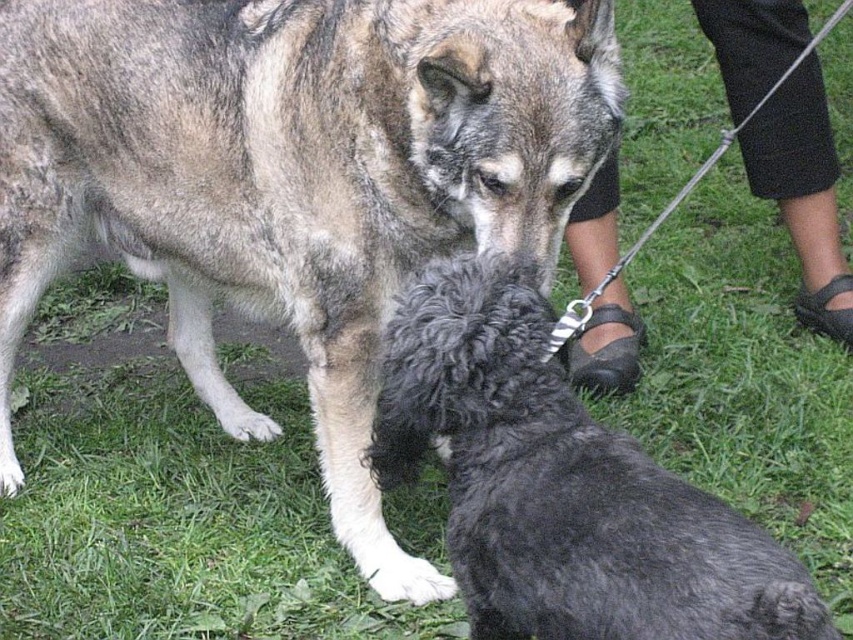
Can you confirm if shiny black fur at center is taller than black leather sandals at lower right?

In fact, shiny black fur at center may be shorter than black leather sandals at lower right.

Is point (447, 525) positioned after point (796, 148)?

That is False.

Is point (602, 588) positioned after point (697, 3)?

No.

Where is `shiny black fur at center`? Image resolution: width=853 pixels, height=640 pixels. shiny black fur at center is located at coordinates (561, 484).

Who is taller, shaggy black dog at center or shiny black fur at center?

shaggy black dog at center is taller.

Is shaggy black dog at center positioned before shiny black fur at center?

No, it is not.

Who is more distant from viewer, (141,180) or (695,492)?

Positioned behind is point (141,180).

Image resolution: width=853 pixels, height=640 pixels. I want to click on shaggy black dog at center, so click(293, 179).

Is shaggy black dog at center below black leather sandals at lower right?

Correct, shaggy black dog at center is located below black leather sandals at lower right.

Based on the photo, between shaggy black dog at center and black leather sandals at lower right, which one has more height?

Standing taller between the two is shaggy black dog at center.

Identify the location of shaggy black dog at center. (293, 179).